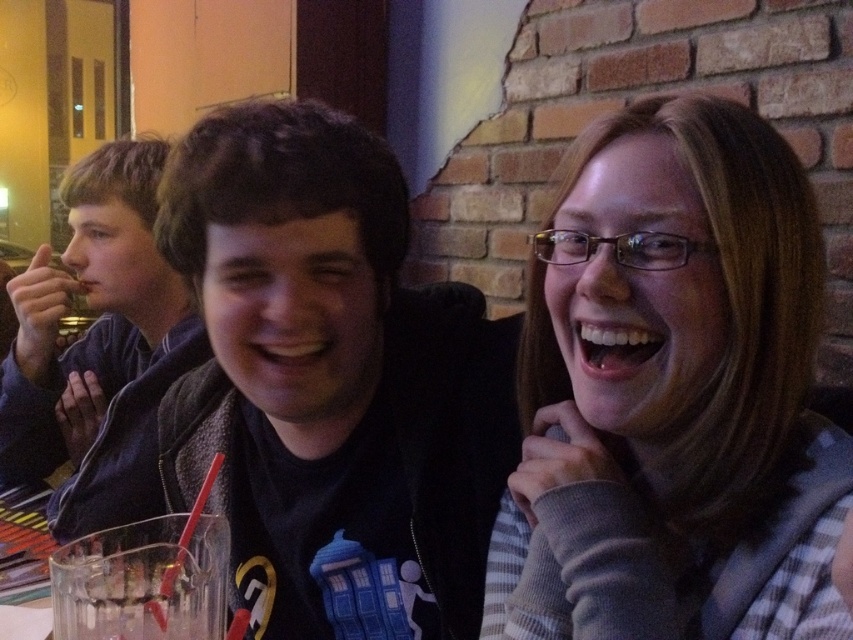
You are a tailor who needs to determine which jacket, the black matte jacket at center or the dark blue jacket at left, requires a longer hem adjustment. Based on the scene, which jacket should you prioritize?

The dark blue jacket at left should be prioritized for hem adjustment since it is longer than the black matte jacket at center.

You are a barista who needs to place a new order on the table. The order includes a hot beverage that must be placed exactly 12 inches away from the plaid shirt at center. Is the clear glass cup at lower left currently positioned correctly for this requirement?

The clear glass cup at lower left is currently 14.23 inches away from the plaid shirt at center, which is 2.23 inches further than the required 12 inches. Therefore, it is not positioned correctly for the new order.

You are a photographer trying to capture a closeup of the plaid shirt at center without the clear glass cup at lower left appearing in the background. Is this possible based on their positions?

The plaid shirt at center is in front of the clear glass cup at lower left, so yes, you can take a closeup of the plaid shirt at center without the clear glass cup at lower left showing in the background.